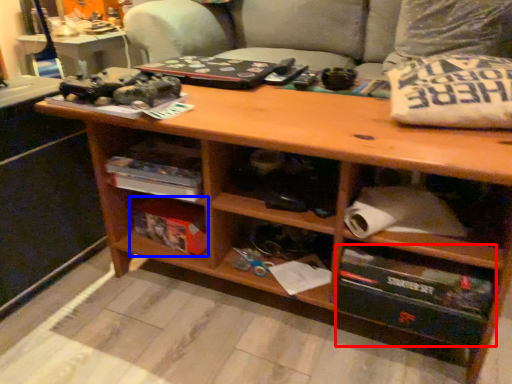
Question: Which object appears farthest to the camera in this image, drawer (highlighted by a red box) or box (highlighted by a blue box)?

Choices:
 (A) drawer
 (B) box

Answer: (B)